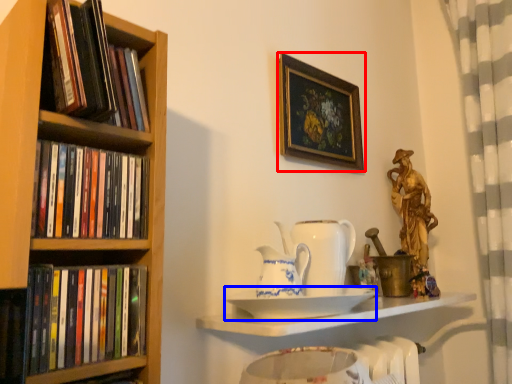
Question: Which object appears closest to the camera in this image, picture frame (highlighted by a red box) or plate (highlighted by a blue box)?

Choices:
 (A) picture frame
 (B) plate

Answer: (B)